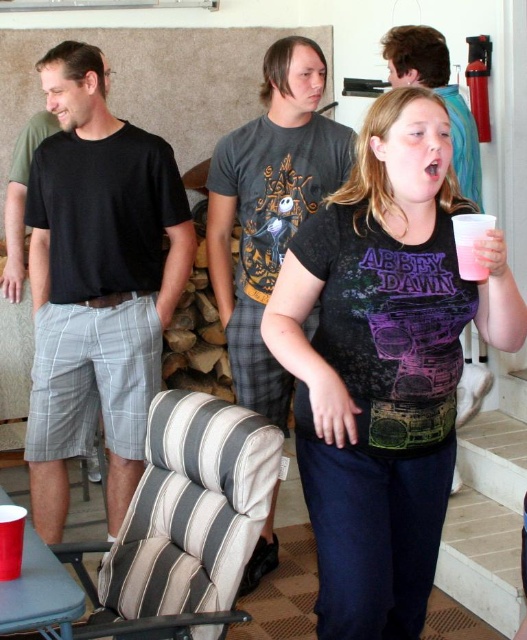
In the scene shown: Is dark gray t-shirt at center to the right of pink plastic cup at right from the viewer's perspective?

In fact, dark gray t-shirt at center is to the left of pink plastic cup at right.

Is dark gray t-shirt at center below pink plastic cup at right?

No.

Who is more distant from viewer, (285, 122) or (472, 275)?

The point (285, 122) is behind.

Locate an element on the screen. dark gray t-shirt at center is located at coordinates (269, 209).

Between black matte t-shirt at center and pink plastic cup at right, which one is positioned lower?

black matte t-shirt at center

Does black matte t-shirt at center lie behind pink plastic cup at right?

Yes, it is behind pink plastic cup at right.

Does point (385, 289) come closer to viewer compared to point (485, 276)?

No, it is behind (485, 276).

Where is `black matte t-shirt at center`? black matte t-shirt at center is located at coordinates (384, 364).

Between black matte t-shirt at center and red plastic cup at lower left, which one appears on the right side from the viewer's perspective?

Positioned to the right is black matte t-shirt at center.

Is point (396, 257) positioned before point (12, 509)?

No, it is not.

What do you see at coordinates (384, 364) in the screenshot? I see `black matte t-shirt at center` at bounding box center [384, 364].

Identify the location of black matte t-shirt at center. The image size is (527, 640). (384, 364).